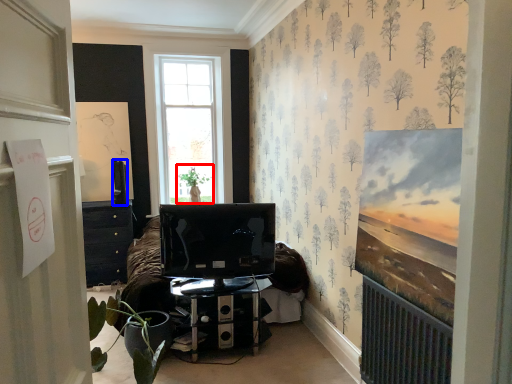
Question: Which object is further to the camera taking this photo, plant (highlighted by a red box) or television (highlighted by a blue box)?

Choices:
 (A) plant
 (B) television

Answer: (A)